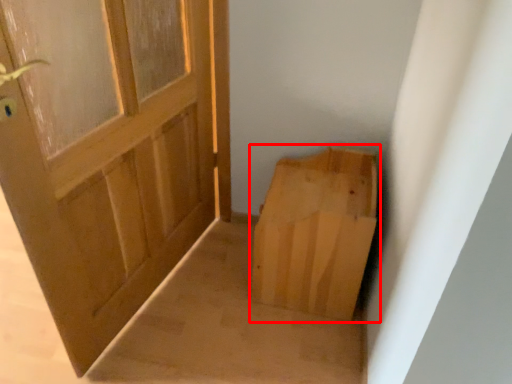
Question: From the image's perspective, where is cardboard box (annotated by the red box) located in relation to door in the image?

Choices:
 (A) below
 (B) above

Answer: (A)